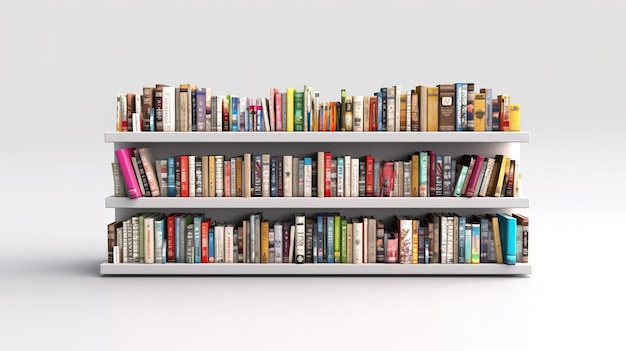
Image resolution: width=626 pixels, height=351 pixels. In order to click on yellow books in this screenshot , I will do `click(290, 120)`, `click(211, 174)`, `click(414, 245)`, `click(515, 120)`, `click(434, 113)`.